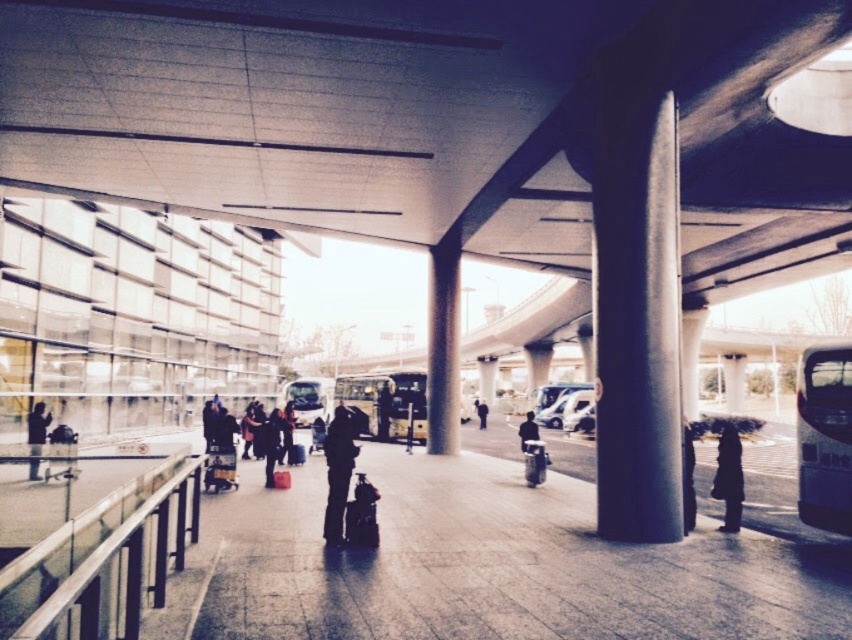
You are a photographer trying to capture a photo of the dark blue jacket at center and dark gray suit at center in the transportation hub. Since you want to ensure both subjects are fully visible in your frame, which subject should you focus on to accommodate their sizes?

The dark blue jacket at center has a larger width than the dark gray suit at center, so you should focus on the dark blue jacket at center to ensure it fits within the frame while still capturing the dark gray suit at center.

You are a traveler carrying a large suitcase and need to reach the transparent glass parking garage at left to drop off your luggage. However, there is a gray concrete pillar at center blocking your path. Based on the scene description, can you walk around the pillar to reach the parking garage?

The transparent glass parking garage at left is positioned on the left side of the gray concrete pillar at center, so you can walk around the left side of the pillar to reach the parking garage.

You are a delivery person standing at the entrance of the transparent glass parking garage at left. You need to deliver a package to the black matte coat at lower right. The delivery robot you have can only travel 80 feet before needing a recharge. Can the robot make the delivery without needing to recharge?

The transparent glass parking garage at left is 85.47 feet away from the black matte coat at lower right. Since the robot can only travel 80 feet before needing a recharge, it cannot make the delivery without recharging first.